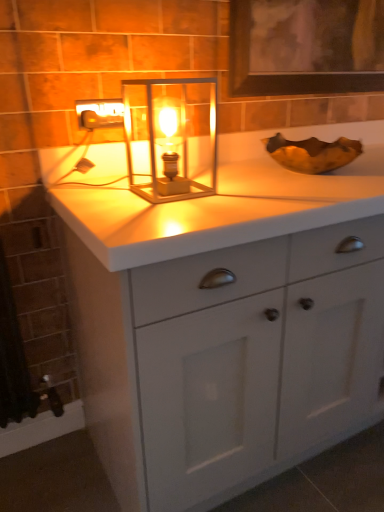
Question: Can you confirm if translucent glass lantern at center is shorter than white matte cabinet at center?

Choices:
 (A) yes
 (B) no

Answer: (A)

Question: Is translucent glass lantern at center wider than white matte cabinet at center?

Choices:
 (A) no
 (B) yes

Answer: (A)

Question: Can you confirm if translucent glass lantern at center is smaller than white matte cabinet at center?

Choices:
 (A) yes
 (B) no

Answer: (A)

Question: From the image's perspective, is translucent glass lantern at center under white matte cabinet at center?

Choices:
 (A) yes
 (B) no

Answer: (B)

Question: Is translucent glass lantern at center further to the viewer compared to white matte cabinet at center?

Choices:
 (A) no
 (B) yes

Answer: (B)

Question: Is point (110, 112) closer or farther from the camera than point (180, 144)?

Choices:
 (A) farther
 (B) closer

Answer: (A)

Question: Relative to translucent glass lantern at center, is matte silver outlet at upper left in front or behind?

Choices:
 (A) front
 (B) behind

Answer: (B)

Question: Considering the positions of matte silver outlet at upper left and translucent glass lantern at center in the image, is matte silver outlet at upper left bigger or smaller than translucent glass lantern at center?

Choices:
 (A) big
 (B) small

Answer: (B)

Question: From a real-world perspective, is matte silver outlet at upper left physically located above or below translucent glass lantern at center?

Choices:
 (A) above
 (B) below

Answer: (A)

Question: Considering the positions of matte silver outlet at upper left and white matte cabinet at center in the image, is matte silver outlet at upper left wider or thinner than white matte cabinet at center?

Choices:
 (A) thin
 (B) wide

Answer: (A)

Question: Relative to white matte cabinet at center, is matte silver outlet at upper left in front or behind?

Choices:
 (A) behind
 (B) front

Answer: (A)

Question: Considering the relative positions of matte silver outlet at upper left and white matte cabinet at center in the image provided, is matte silver outlet at upper left to the left or to the right of white matte cabinet at center?

Choices:
 (A) right
 (B) left

Answer: (B)

Question: Considering the positions of matte silver outlet at upper left and white matte cabinet at center in the image, is matte silver outlet at upper left taller or shorter than white matte cabinet at center?

Choices:
 (A) tall
 (B) short

Answer: (B)

Question: Would you say translucent glass lantern at center is to the left or to the right of matte silver outlet at upper left in the picture?

Choices:
 (A) right
 (B) left

Answer: (A)

Question: Is translucent glass lantern at center bigger or smaller than matte silver outlet at upper left?

Choices:
 (A) big
 (B) small

Answer: (A)